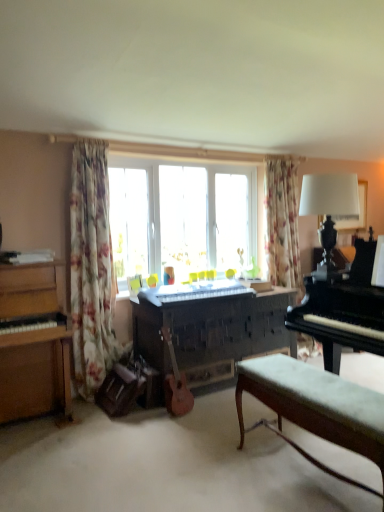
Question: From the image's perspective, is white fabric lampshade at upper right on velvet green bench at lower right?

Choices:
 (A) no
 (B) yes

Answer: (B)

Question: Is the position of white fabric lampshade at upper right less distant than that of velvet green bench at lower right?

Choices:
 (A) yes
 (B) no

Answer: (B)

Question: Is white fabric lampshade at upper right aimed at velvet green bench at lower right?

Choices:
 (A) yes
 (B) no

Answer: (B)

Question: Is white fabric lampshade at upper right wider than velvet green bench at lower right?

Choices:
 (A) yes
 (B) no

Answer: (A)

Question: Is white fabric lampshade at upper right further to camera compared to velvet green bench at lower right?

Choices:
 (A) yes
 (B) no

Answer: (A)

Question: From a real-world perspective, is white fabric lampshade at upper right below velvet green bench at lower right?

Choices:
 (A) no
 (B) yes

Answer: (A)

Question: Is dark wood piano at center, which is counted as the second piano, starting from the right, a part of floral fabric curtain at left, the second curtain when ordered from back to front?

Choices:
 (A) no
 (B) yes

Answer: (A)

Question: Are floral fabric curtain at left, the 2th curtain in the right-to-left sequence, and dark wood piano at center, which is counted as the second piano, starting from the right, beside each other?

Choices:
 (A) yes
 (B) no

Answer: (B)

Question: Does floral fabric curtain at left, the 2th curtain in the right-to-left sequence, have a smaller size compared to dark wood piano at center, marked as the second piano in a left-to-right arrangement?

Choices:
 (A) no
 (B) yes

Answer: (B)

Question: From a real-world perspective, is floral fabric curtain at left, the 1th curtain in the left-to-right sequence, beneath dark wood piano at center, marked as the second piano in a left-to-right arrangement?

Choices:
 (A) no
 (B) yes

Answer: (A)

Question: From a real-world perspective, is floral fabric curtain at left, the 2th curtain in the right-to-left sequence, physically above dark wood piano at center, marked as the second piano in a left-to-right arrangement?

Choices:
 (A) yes
 (B) no

Answer: (A)

Question: Can you confirm if floral fabric curtain at left, the 1th curtain in the left-to-right sequence, is taller than dark wood piano at center, which is counted as the second piano, starting from the right?

Choices:
 (A) yes
 (B) no

Answer: (A)

Question: From a real-world perspective, does white fabric lampshade at upper right sit lower than black polished piano at right, the 3th piano viewed from the left?

Choices:
 (A) no
 (B) yes

Answer: (A)